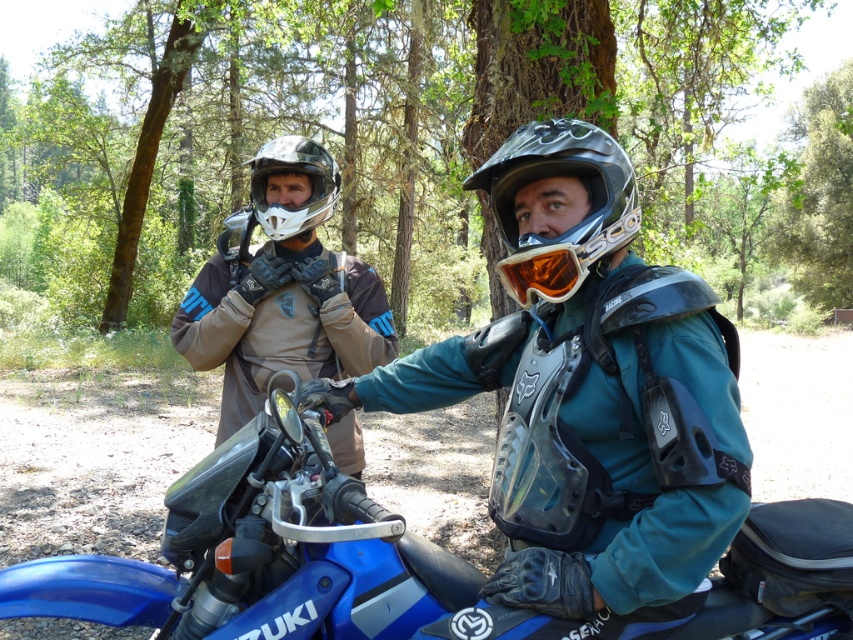
Question: Can you confirm if brown bark tree at center is positioned to the right of matte black helmet at center?

Choices:
 (A) no
 (B) yes

Answer: (B)

Question: Among these objects, which one is nearest to the camera?

Choices:
 (A) blue metallic motorcycle at center
 (B) matte black helmet at upper center

Answer: (B)

Question: Does teal matte jacket at center lie behind matte black jacket at center?

Choices:
 (A) no
 (B) yes

Answer: (A)

Question: Which of the following is the farthest from the observer?

Choices:
 (A) (259, 156)
 (B) (346, 451)
 (C) (643, 538)

Answer: (B)

Question: Does blue metallic motorcycle at center appear under matte black helmet at center?

Choices:
 (A) no
 (B) yes

Answer: (B)

Question: Which is nearer to the matte black helmet at center?

Choices:
 (A) matte black jacket at center
 (B) teal matte jacket at center
 (C) blue metallic motorcycle at center

Answer: (B)